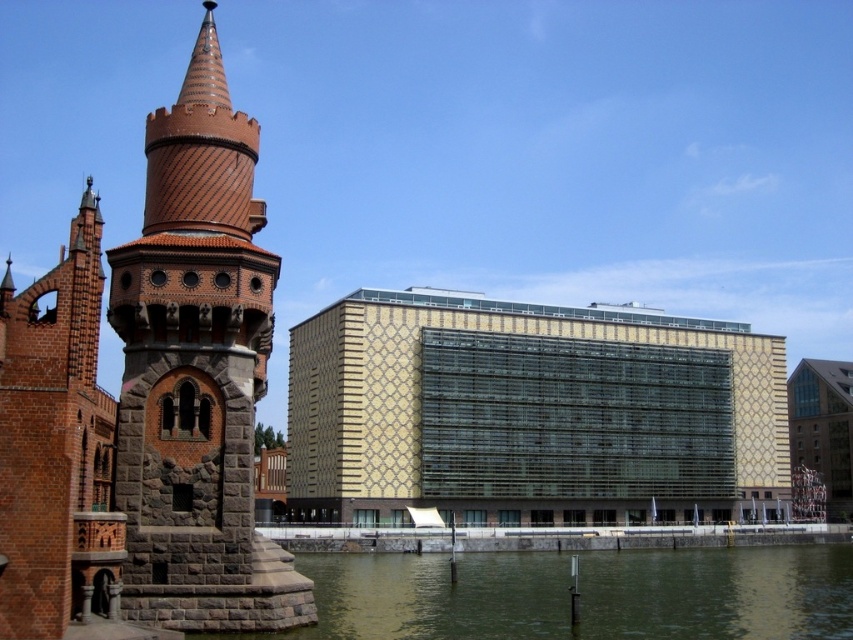
You are standing at the waterfront and see two points marked in the image. The first point is at coordinates point (207, 3) and the second is at point (743, 563). Which point is closer to you?

Point (207, 3) is closer to you because it is further to the viewer than point (743, 563).

You are a photographer positioned at the waterfront scene. You want to capture the brown textured stone tower at left in your shot. Considering your camera can focus on objects up to 30 meters away, will the tower be in focus?

The brown textured stone tower at left is 31.15 meters away from the camera, which exceeds the camera focus limit of 30 meters. Thus, the tower will not be in focus.

Consider the image. You are standing at a viewpoint overlooking the waterfront scene. There is a specific point marked at coordinates point [196,529]. Can you estimate how far this point is from your current position?

The distance between point [196,529] and the viewer is 33.98 meters.